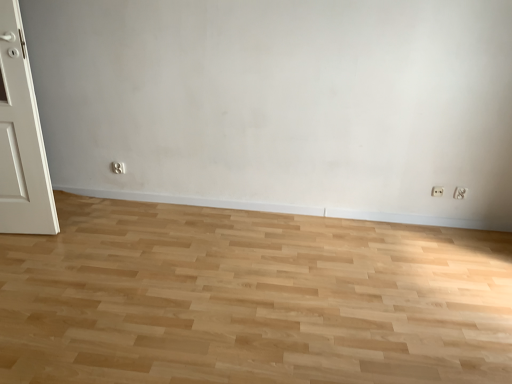
Find the location of a particular element. The image size is (512, 384). blank space situated above natural wood floor at center (from a real-world perspective) is located at coordinates (224, 301).